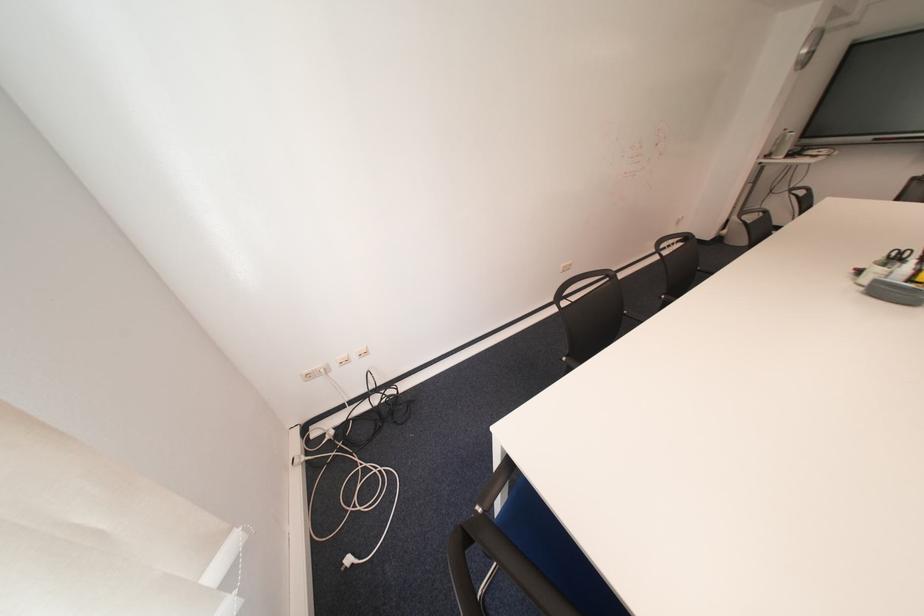
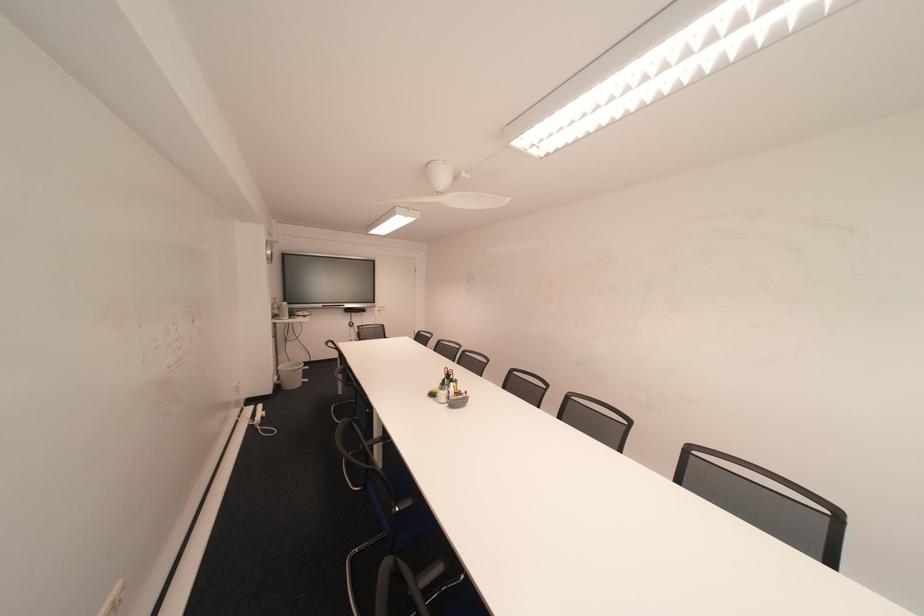
Question: The camera is either moving clockwise (left) or counter-clockwise (right) around the object. The first image is from the beginning of the video and the second image is from the end. Is the camera moving left or right when shooting the video?

Choices:
 (A) Left
 (B) Right

Answer: (A)